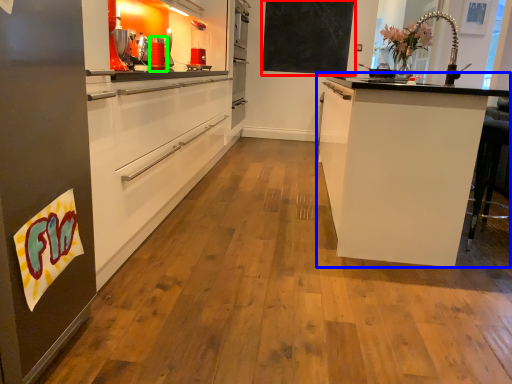
Question: Considering the real-world distances, which object is closest to bulletin board (highlighted by a red box)? cabinetry (highlighted by a blue box) or appliance (highlighted by a green box).

Choices:
 (A) cabinetry
 (B) appliance

Answer: (B)